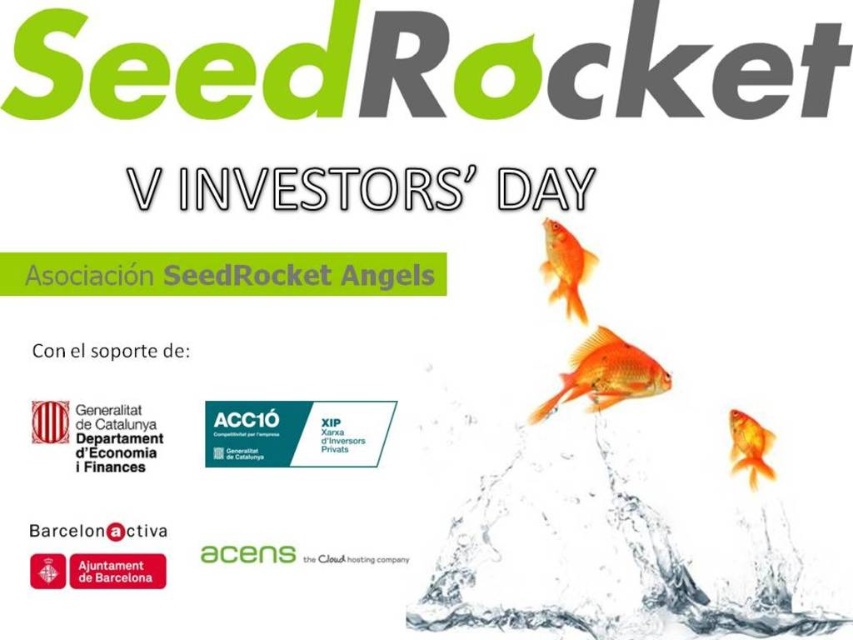
Measure the distance between transparent liquid water at center and camera.

1.07 meters

Can you confirm if transparent liquid water at center is positioned below glossy orange fish at upper right?

Correct, transparent liquid water at center is located below glossy orange fish at upper right.

Identify the location of transparent liquid water at center. (618, 548).

You are a GUI agent. You are given a task and a screenshot of the screen. Output one action in this format:
    pyautogui.click(x=<x>, y=<y>)
    Task: Click on the transparent liquid water at center
    
    Given the screenshot: What is the action you would take?
    pyautogui.click(x=618, y=548)

How far apart are shiny orange fish at upper right and orange matte goldfish at right?

9.51 inches

Can you confirm if shiny orange fish at upper right is positioned to the right of orange matte goldfish at right?

No, shiny orange fish at upper right is not to the right of orange matte goldfish at right.

I want to click on shiny orange fish at upper right, so click(x=566, y=266).

This screenshot has height=640, width=853. Find the location of `shiny orange fish at upper right`. shiny orange fish at upper right is located at coordinates (566, 266).

Between glossy orange fish at upper right and orange matte goldfish at right, which one has less height?

With less height is orange matte goldfish at right.

Does point (581, 362) lie in front of point (761, 461)?

No.

Who is more distant from viewer, (646, 362) or (744, 454)?

The point (646, 362) is behind.

At what (x,y) coordinates should I click in order to perform the action: click on glossy orange fish at upper right. Please return your answer as a coordinate pair (x, y). The image size is (853, 640). Looking at the image, I should click on (606, 374).